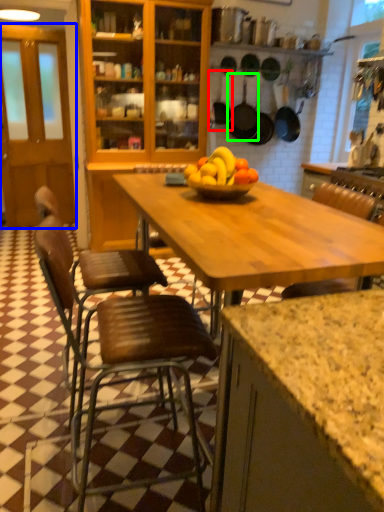
Question: Which object is positioned closest to frying pan (highlighted by a red box)? Select from glass door (highlighted by a blue box) and frying pan (highlighted by a green box).

Choices:
 (A) glass door
 (B) frying pan

Answer: (B)